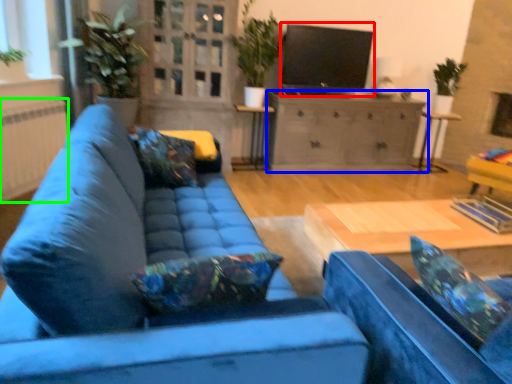
Question: Considering the real-world distances, which object is farthest from open (highlighted by a red box)? cabinetry (highlighted by a blue box) or radiator (highlighted by a green box)?

Choices:
 (A) cabinetry
 (B) radiator

Answer: (B)